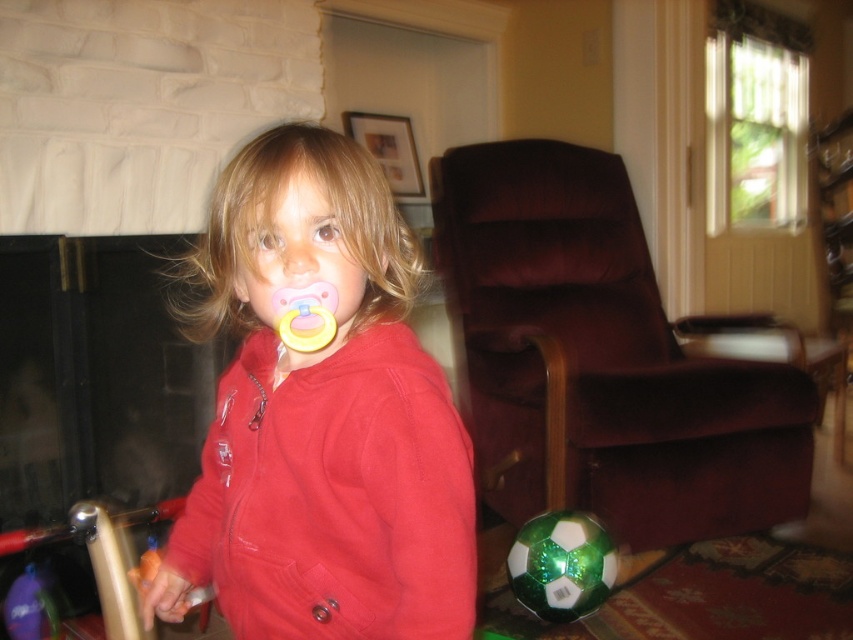
Which of these two, matte red jacket at center or pink rubber pacifier at center, stands shorter?

With less height is pink rubber pacifier at center.

Which is in front, point (381, 428) or point (306, 344)?

Positioned in front is point (306, 344).

Is point (384, 490) closer to camera compared to point (323, 285)?

No.

You are a GUI agent. You are given a task and a screenshot of the screen. Output one action in this format:
    pyautogui.click(x=<x>, y=<y>)
    Task: Click on the matte red jacket at center
    The width and height of the screenshot is (853, 640).
    Given the screenshot: What is the action you would take?
    321,417

Between point (769, 484) and point (299, 342), which one is positioned behind?

Point (769, 484)

Describe the element at coordinates (599, 358) in the screenshot. This screenshot has width=853, height=640. I see `velvet brown armchair at right` at that location.

Where is `velvet brown armchair at right`? This screenshot has height=640, width=853. velvet brown armchair at right is located at coordinates (599, 358).

Is matte red jacket at center below velvet brown armchair at right?

Correct, matte red jacket at center is located below velvet brown armchair at right.

Image resolution: width=853 pixels, height=640 pixels. Identify the location of matte red jacket at center. (321, 417).

Where is `matte red jacket at center`? matte red jacket at center is located at coordinates (321, 417).